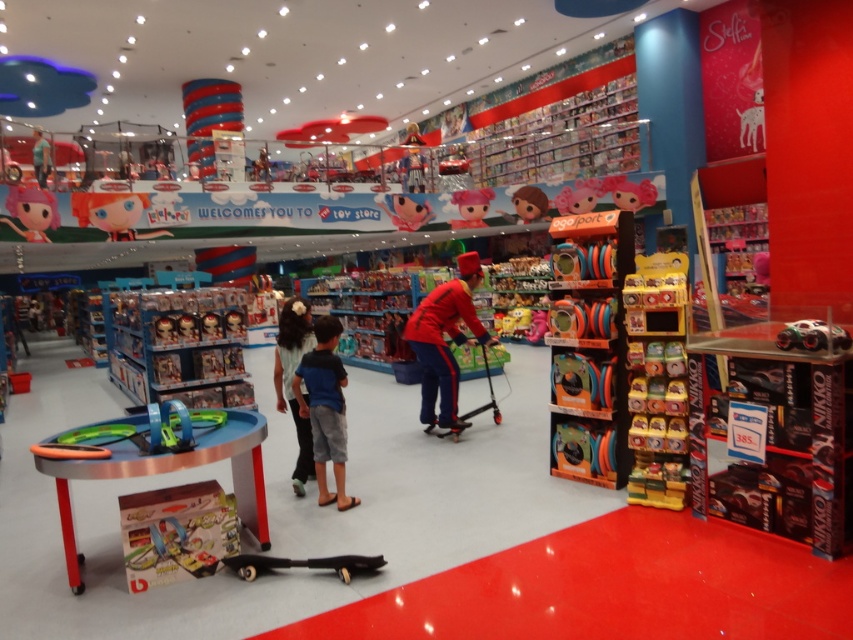
You are a store employee organizing the toy store. You have two items to place on a shelf that can only hold one of them. The items are the blue cotton shorts at center and the light blue denim jeans at center. Which item should you choose to fit on the shelf?

Result: The blue cotton shorts at center occupies less space than the light blue denim jeans at center, so you should choose the blue cotton shorts at center to fit on the shelf.

You are a parent looking for a toy for your child. You see a shiny plastic doll at upper left and a shiny pink doll at center. Which one is bigger?

The shiny plastic doll at upper left is larger in size compared to the shiny pink doll at center.